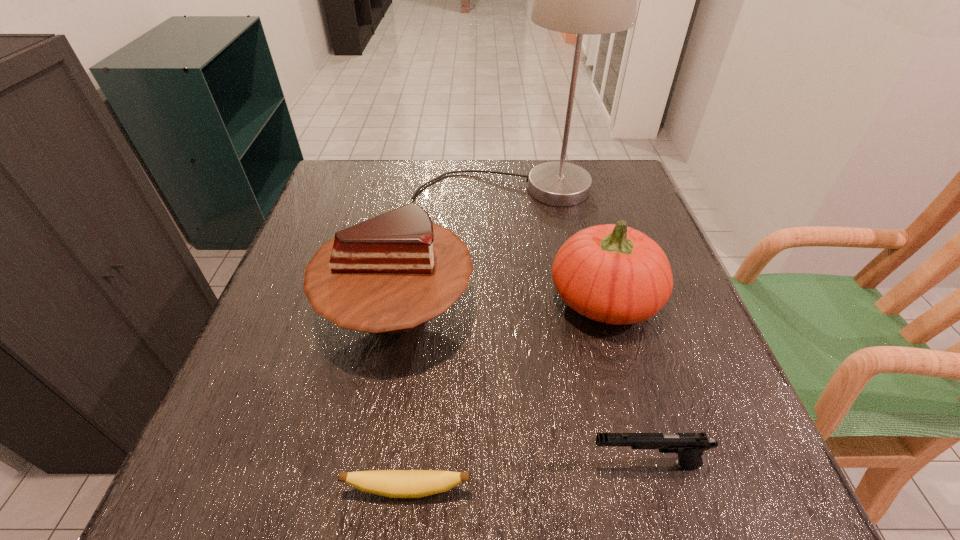
Where is `vacant space situated 0.080m on the left of the pumpkin`? The height and width of the screenshot is (540, 960). vacant space situated 0.080m on the left of the pumpkin is located at coordinates (510, 299).

Where is `free space located at the aiming end of the gun`? free space located at the aiming end of the gun is located at coordinates 467,464.

At what (x,y) coordinates should I click in order to perform the action: click on vacant space located at the aiming end of the gun. Please return your answer as a coordinate pair (x, y). The height and width of the screenshot is (540, 960). Looking at the image, I should click on (446, 464).

Where is `vacant point located 0.080m at the aiming end of the gun`? vacant point located 0.080m at the aiming end of the gun is located at coordinates (535, 464).

The image size is (960, 540). In order to click on vacant area situated 0.080m on the back of the nearest object in this screenshot , I will do pyautogui.click(x=415, y=427).

At what (x,y) coordinates should I click in order to perform the action: click on object located in the far edge section of the desktop. Please return your answer as a coordinate pair (x, y). The image size is (960, 540). Looking at the image, I should click on (579, 0).

Identify the location of gun positioned at the near edge. This screenshot has width=960, height=540. (689, 446).

You are a GUI agent. You are given a task and a screenshot of the screen. Output one action in this format:
    pyautogui.click(x=<x>, y=<y>)
    Task: Click on the banana that is positioned at the near edge
    This screenshot has height=540, width=960.
    Given the screenshot: What is the action you would take?
    pyautogui.click(x=390, y=483)

Where is `object at the left edge`? This screenshot has width=960, height=540. object at the left edge is located at coordinates (389, 274).

The height and width of the screenshot is (540, 960). I want to click on table lamp at the right edge, so click(x=579, y=0).